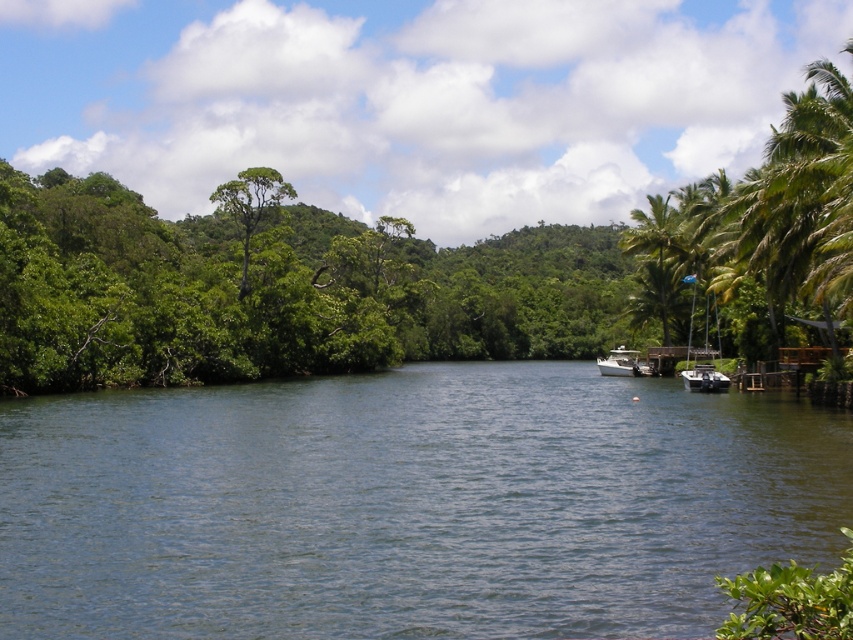
You are standing on the wooden pier and want to walk towards the green leafy tree at center and the metallic silver boat at right. Which object will you reach first?

You will reach the green leafy tree at center first because it is closer to you than the metallic silver boat at right, which is further away.

You are standing at the center of the river and want to reach the green leafy tree at right. According to the coordinates, in which direction should you move?

The green leafy tree at right is located at coordinates 0.455 on the x axis and 0.334 on the y axis. Since you are at the center of the river, you should move towards the right side to reach the green leafy tree at right.

You are planning to plant a new tree in your backyard and want to know which tree from the image would take up more horizontal space. Which tree has a wider spread? Please refer to the green leafy tree at right and the green leafy palm tree at right.

The green leafy tree at right has a wider spread than the green leafy palm tree at right, as its width is larger according to the description.